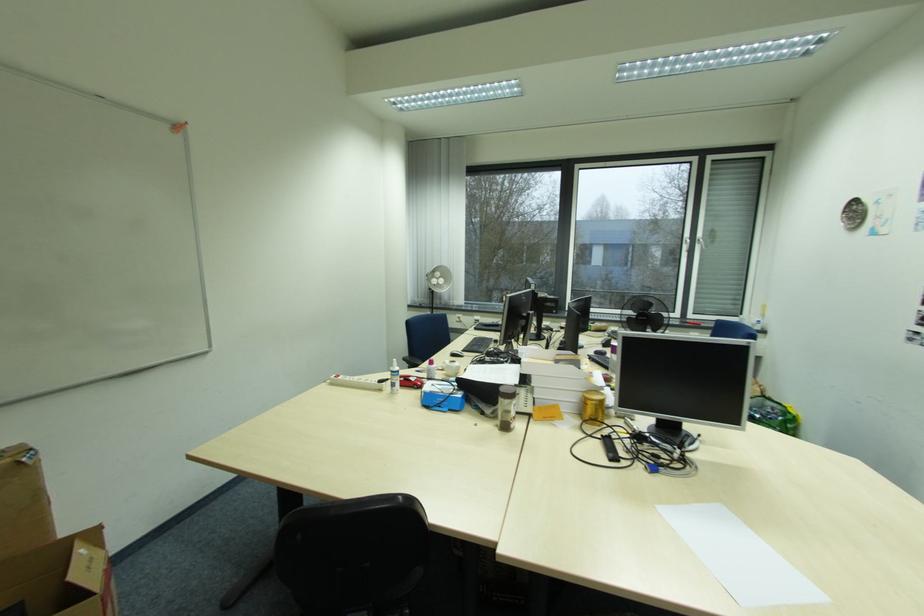
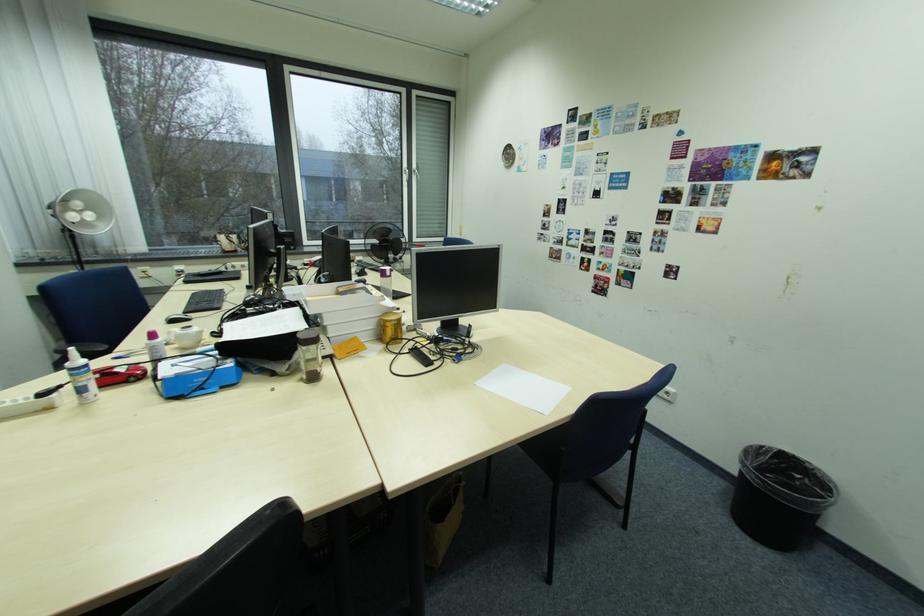
Locate, in the second image, the point that corresponds to the point at 505,426 in the first image.

(310, 381)